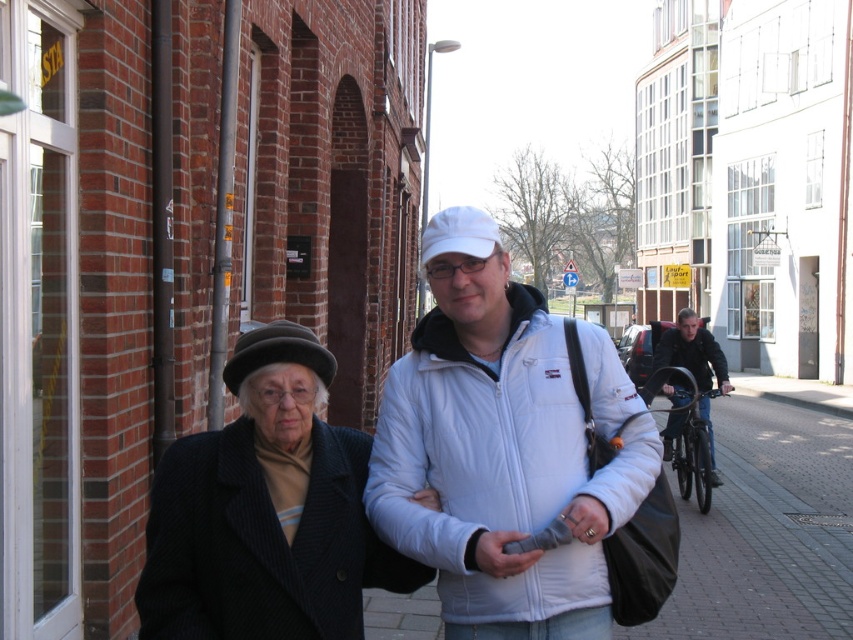
You are a photographer trying to capture the scene in the image. You notice two items of interest in the center area. Which item is positioned to the right of the other? The items are the white fabric jacket at center and the matte black phone at center.

The white fabric jacket at center is positioned to the right of the matte black phone at center.

You are a photographer trying to capture a clear photo of the white fabric jacket at center and the matte black phone at center. Since you want both objects in focus, you need to know which one is closer to the camera. Can you determine which object is nearer based on their sizes?

The white fabric jacket at center is larger in size than the matte black phone at center, so the white fabric jacket at center is closer to the camera.